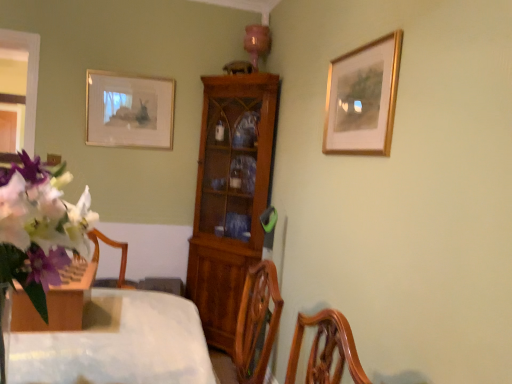
Question: Does matte white picture frame at upper left, which appears as the 1th picture frame when viewed from the left, have a greater width compared to wooden cabinet at center?

Choices:
 (A) yes
 (B) no

Answer: (B)

Question: Can you confirm if matte white picture frame at upper left, which ranks as the 1th picture frame in back-to-front order, is smaller than wooden cabinet at center?

Choices:
 (A) yes
 (B) no

Answer: (A)

Question: Considering the relative sizes of matte white picture frame at upper left, which appears as the 1th picture frame when viewed from the left, and wooden cabinet at center in the image provided, is matte white picture frame at upper left, which appears as the 1th picture frame when viewed from the left, thinner than wooden cabinet at center?

Choices:
 (A) no
 (B) yes

Answer: (B)

Question: Is matte white picture frame at upper left, the second picture frame when ordered from front to back, in front of wooden cabinet at center?

Choices:
 (A) yes
 (B) no

Answer: (B)

Question: Does matte white picture frame at upper left, the second picture frame when ordered from front to back, appear on the left side of wooden cabinet at center?

Choices:
 (A) no
 (B) yes

Answer: (B)

Question: Visually, is white matte flower at left positioned to the left or to the right of wooden cabinet at center?

Choices:
 (A) right
 (B) left

Answer: (B)

Question: From their relative heights in the image, would you say white matte flower at left is taller or shorter than wooden cabinet at center?

Choices:
 (A) tall
 (B) short

Answer: (B)

Question: In terms of width, does white matte flower at left look wider or thinner when compared to wooden cabinet at center?

Choices:
 (A) thin
 (B) wide

Answer: (A)

Question: Looking at the image, does white matte flower at left seem bigger or smaller compared to wooden cabinet at center?

Choices:
 (A) big
 (B) small

Answer: (B)

Question: Based on their positions, is gold/golden picture frame at upper right, the 2th picture frame when ordered from left to right, located to the left or right of wooden cabinet at center?

Choices:
 (A) right
 (B) left

Answer: (A)

Question: Is gold/golden picture frame at upper right, which is the first picture frame from front to back, taller or shorter than wooden cabinet at center?

Choices:
 (A) short
 (B) tall

Answer: (A)

Question: Is gold/golden picture frame at upper right, which is the first picture frame from front to back, inside or outside of wooden cabinet at center?

Choices:
 (A) inside
 (B) outside

Answer: (B)

Question: From a real-world perspective, is gold/golden picture frame at upper right, which is the first picture frame from front to back, physically located above or below wooden cabinet at center?

Choices:
 (A) below
 (B) above

Answer: (B)

Question: In terms of size, does wooden cabinet at center appear bigger or smaller than gold/golden picture frame at upper right, the 2th picture frame when ordered from left to right?

Choices:
 (A) big
 (B) small

Answer: (A)

Question: Looking at their shapes, would you say wooden cabinet at center is wider or thinner than gold/golden picture frame at upper right, which ranks as the 1th picture frame in right-to-left order?

Choices:
 (A) thin
 (B) wide

Answer: (B)